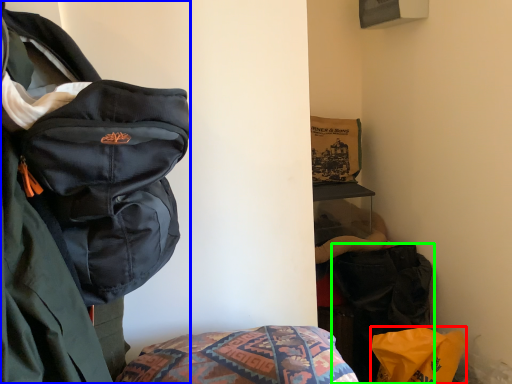
Question: Estimate the real-world distances between objects in this image. Which object is farther from material (highlighted by a red box), backpack (highlighted by a blue box) or luggage and bags (highlighted by a green box)?

Choices:
 (A) backpack
 (B) luggage and bags

Answer: (A)